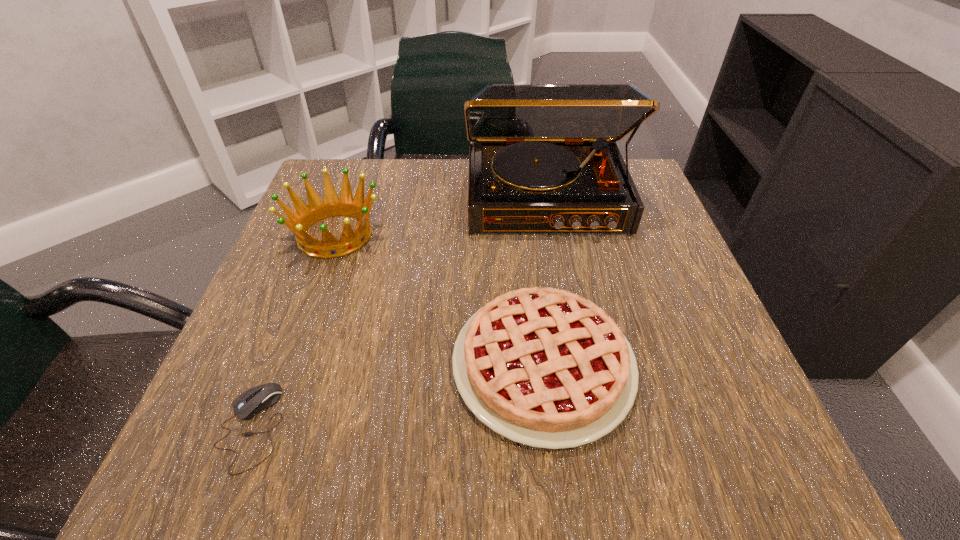
You are a GUI agent. You are given a task and a screenshot of the screen. Output one action in this format:
    pyautogui.click(x=<x>, y=<y>)
    Task: Click on the pie located at the near edge
    The image size is (960, 540).
    Given the screenshot: What is the action you would take?
    pyautogui.click(x=543, y=367)

Where is `computer mouse located at the near edge`? The height and width of the screenshot is (540, 960). computer mouse located at the near edge is located at coordinates (251, 402).

Find the location of a particular element. crown at the left edge is located at coordinates (299, 222).

The height and width of the screenshot is (540, 960). Find the location of `computer mouse that is at the left edge`. computer mouse that is at the left edge is located at coordinates (251, 402).

I want to click on record player located at the right edge, so click(543, 158).

You are a GUI agent. You are given a task and a screenshot of the screen. Output one action in this format:
    pyautogui.click(x=<x>, y=<y>)
    Task: Click on the pie located at the right edge
    This screenshot has width=960, height=540.
    Given the screenshot: What is the action you would take?
    pyautogui.click(x=543, y=367)

At what (x,y) coordinates should I click in order to perform the action: click on object located at the far left corner. Please return your answer as a coordinate pair (x, y). Image resolution: width=960 pixels, height=540 pixels. Looking at the image, I should click on (299, 222).

Identify the location of object situated at the near left corner. (251, 402).

Identify the location of object at the far right corner. (543, 158).

Locate an element on the screen. object located at the near right corner is located at coordinates (543, 367).